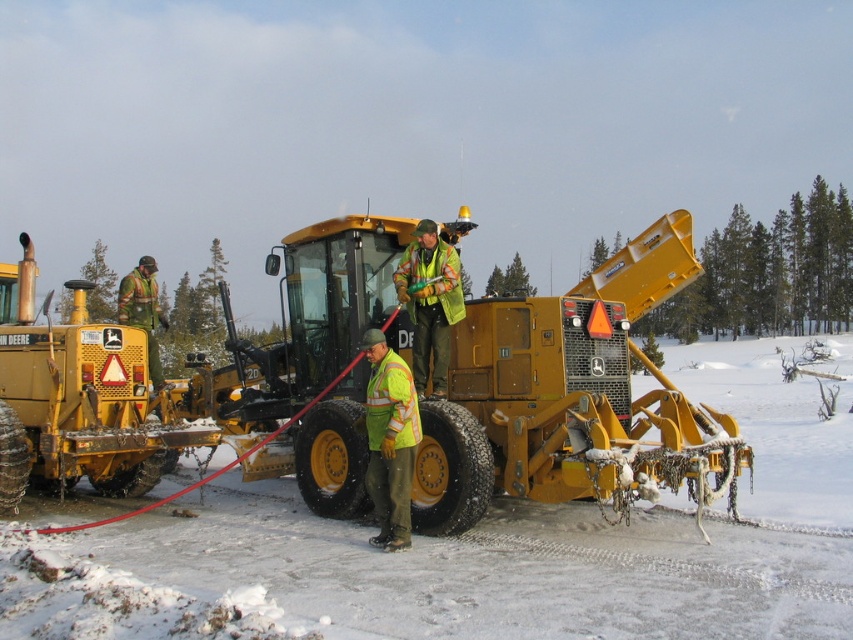
You are a worker standing at the point labeled as point (x=567, y=396) in the snowy scene. You need to reach the yellow John Deere grader with its blade extended and covered in snow. Is the path from your current position to the yellow John Deere grader clear of any obstacles?

The point (x=567, y=396) corresponds to the matte yellow tractor at center, so the path from the matte yellow tractor at center to the yellow John Deere grader with its blade extended and covered in snow is clear of obstacles as there are no objects mentioned between them in the scene description.